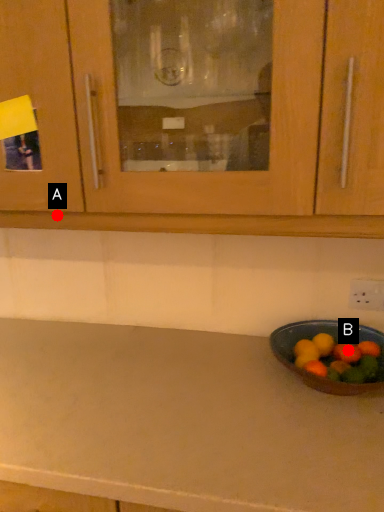
Question: Two points are circled on the image, labeled by A and B beside each circle. Which of the following is the farthest from the observer?

Choices:
 (A) A is further
 (B) B is further

Answer: (B)